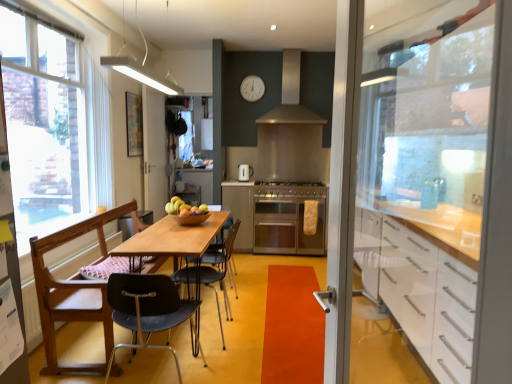
Locate an element on the screen. The image size is (512, 384). free space above orange matte door handle at center (from a real-world perspective) is located at coordinates (291, 318).